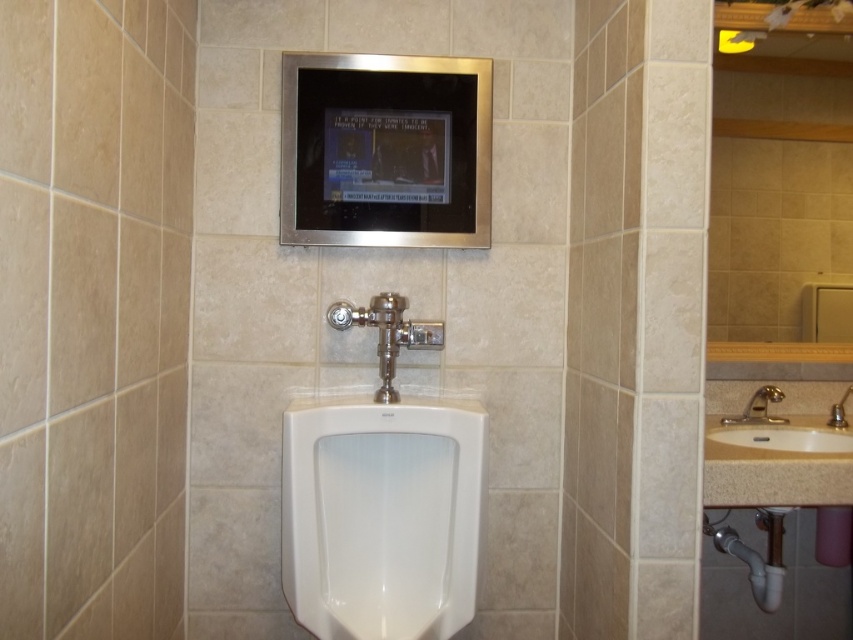
Question: Which of the following is the closest to the observer?

Choices:
 (A) white glossy urinal at center
 (B) gold metallic faucet at right
 (C) white ceramic sink at right

Answer: (A)

Question: Can you confirm if white ceramic sink at right is positioned below silver metallic faucet at lower right?

Choices:
 (A) no
 (B) yes

Answer: (B)

Question: Does gold metallic faucet at right appear under silver metallic faucet at lower right?

Choices:
 (A) no
 (B) yes

Answer: (B)

Question: Does white glossy urinal at center appear on the left side of white ceramic sink at right?

Choices:
 (A) yes
 (B) no

Answer: (A)

Question: Which object appears closest to the camera in this image?

Choices:
 (A) silver metallic faucet at lower right
 (B) gold metallic faucet at right

Answer: (A)

Question: Estimate the real-world distances between objects in this image. Which object is closer to the white ceramic sink at right?

Choices:
 (A) silver metallic faucet at lower right
 (B) white glossy urinal at center
 (C) gold metallic faucet at right

Answer: (C)